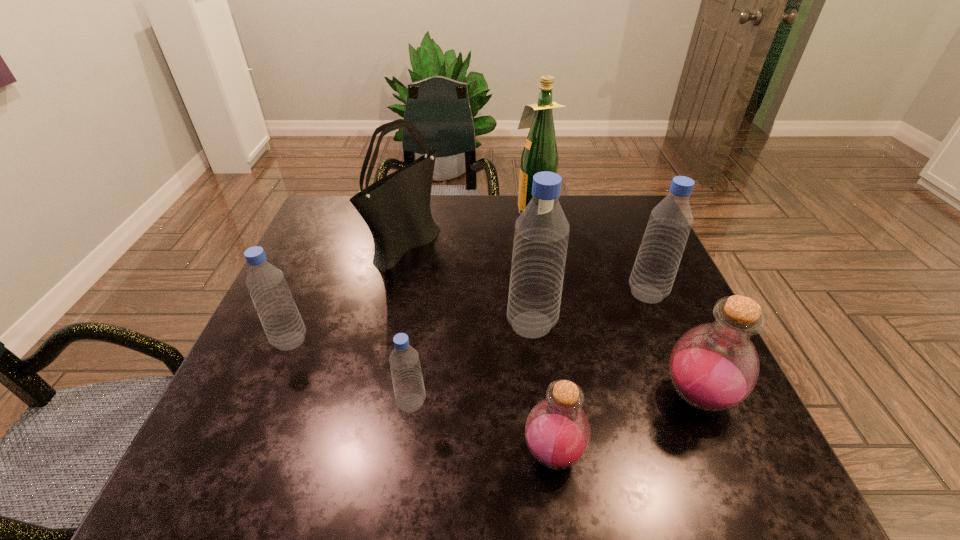
You are a GUI agent. You are given a task and a screenshot of the screen. Output one action in this format:
    pyautogui.click(x=<x>, y=<y>)
    Task: Click on the liquor
    The height and width of the screenshot is (540, 960).
    Given the screenshot: What is the action you would take?
    pyautogui.click(x=540, y=153)

The width and height of the screenshot is (960, 540). I want to click on the second blue bottle from right to left, so click(541, 235).

Locate an element on the screen. This screenshot has width=960, height=540. the biggest blue bottle is located at coordinates (541, 235).

Identify the location of shoulder bag. (396, 208).

Locate an element on the screen. The image size is (960, 540). the sixth nearest object is located at coordinates (669, 225).

Find the location of `the farthest bottle`. the farthest bottle is located at coordinates (669, 225).

The height and width of the screenshot is (540, 960). Identify the location of the second smallest blue bottle. (278, 313).

Locate an element on the screen. This screenshot has height=540, width=960. the leftmost bottle is located at coordinates (278, 313).

Where is `the bigger purple bottle`? the bigger purple bottle is located at coordinates click(x=713, y=367).

Find the location of a particular element. The image size is (960, 540). the second blue bottle from left to right is located at coordinates (409, 391).